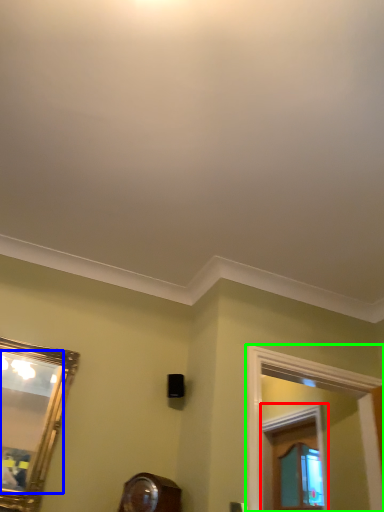
Question: Which is nearer to the window frame (highlighted by a red box)? mirror (highlighted by a blue box) or window frame (highlighted by a green box).

Choices:
 (A) mirror
 (B) window frame

Answer: (B)